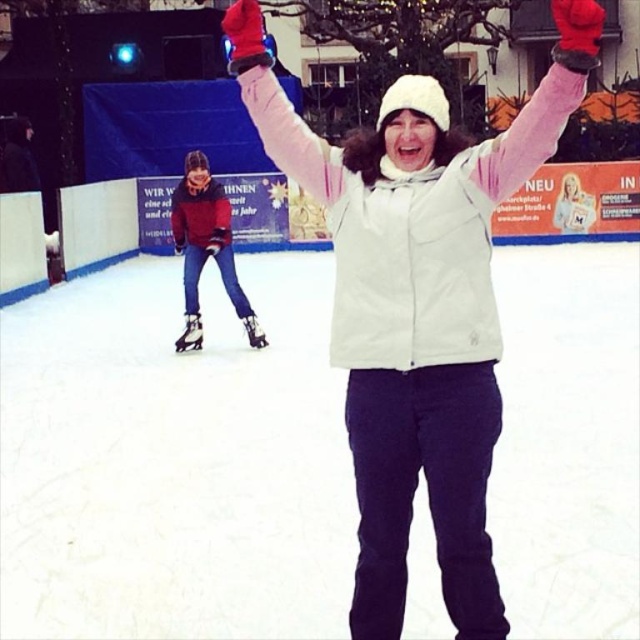
Does white smooth ice at center have a larger size compared to white matte jacket at center?

Correct, white smooth ice at center is larger in size than white matte jacket at center.

Does white smooth ice at center have a lesser height compared to white matte jacket at center?

Correct, white smooth ice at center is not as tall as white matte jacket at center.

Does point (10, 396) lie behind point (428, 321)?

Yes.

In order to click on white smooth ice at center in this screenshot , I will do `click(173, 460)`.

In the scene shown: Does white smooth ice at center appear on the left side of matte red jacket at lower left?

In fact, white smooth ice at center is to the right of matte red jacket at lower left.

You are a GUI agent. You are given a task and a screenshot of the screen. Output one action in this format:
    pyautogui.click(x=<x>, y=<y>)
    Task: Click on the white smooth ice at center
    The width and height of the screenshot is (640, 640).
    Given the screenshot: What is the action you would take?
    pyautogui.click(x=173, y=460)

Does white matte jacket at center appear on the right side of matte red jacket at lower left?

Correct, you'll find white matte jacket at center to the right of matte red jacket at lower left.

Can you confirm if white matte jacket at center is shorter than matte red jacket at lower left?

No, white matte jacket at center is not shorter than matte red jacket at lower left.

Is point (477, 484) behind point (172, 214)?

No, it is in front of (172, 214).

The image size is (640, 640). In order to click on white matte jacket at center in this screenshot , I will do (x=417, y=305).